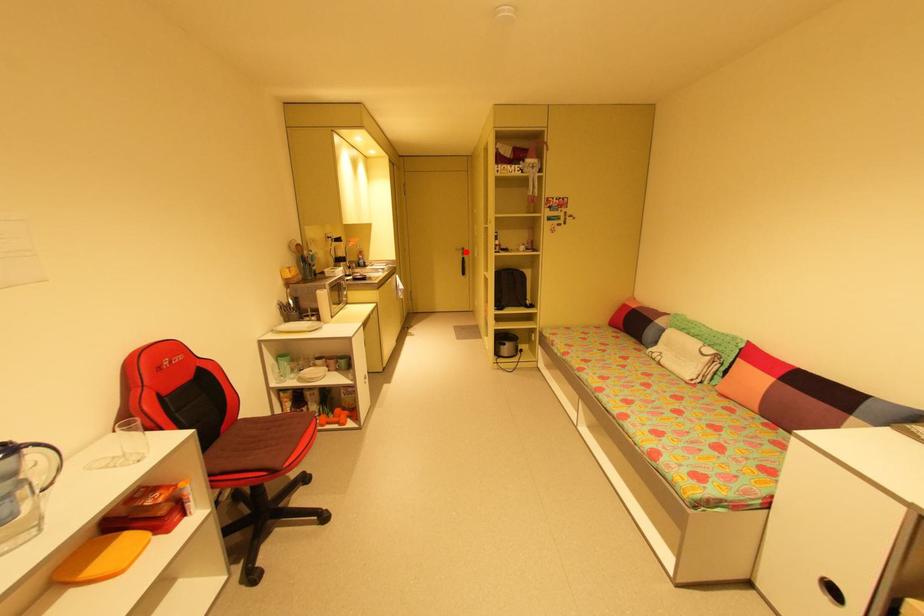
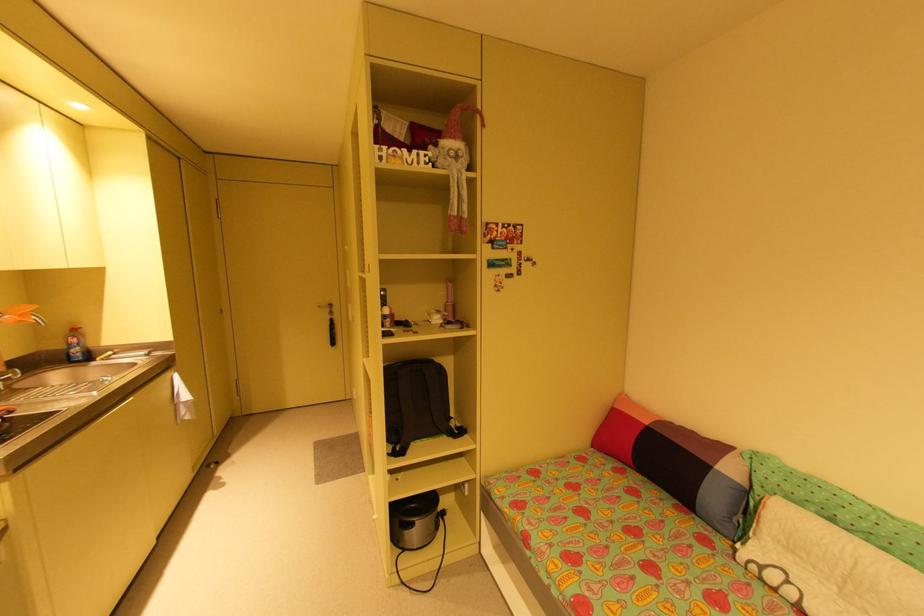
Question: I am providing you with two images of the same scene from different viewpoints. Image1 has a red point marked. In image2, the corresponding 3D location appears at what relative position? Reply with the corresponding letter.

Choices:
 (A) Closer
 (B) Farther

Answer: (B)